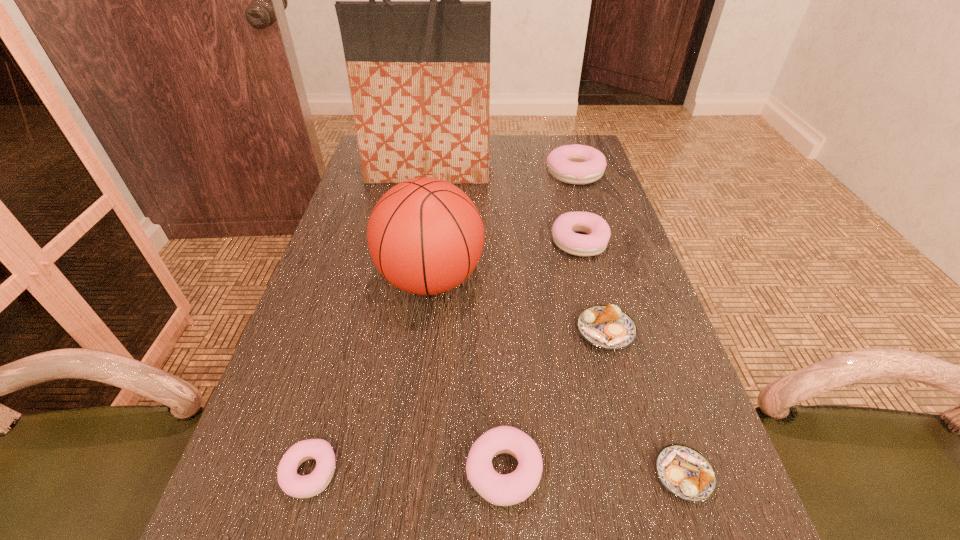
The width and height of the screenshot is (960, 540). I want to click on the leftmost pastry, so click(x=297, y=486).

The height and width of the screenshot is (540, 960). Find the location of `the leftmost pink pastry`. the leftmost pink pastry is located at coordinates 297,486.

Image resolution: width=960 pixels, height=540 pixels. I want to click on the smaller brown pastry, so click(683, 471).

You are a GUI agent. You are given a task and a screenshot of the screen. Output one action in this format:
    pyautogui.click(x=<x>, y=<y>)
    Task: Click on the free point located on the front-facing side of the tallest object
    
    Given the screenshot: What is the action you would take?
    pyautogui.click(x=413, y=264)

Find the location of a particular element. vacant space located 0.350m on the back of the basketball is located at coordinates (444, 174).

Locate an element on the screen. vacant region located on the front of the third tallest object is located at coordinates (596, 244).

In order to click on blank space located 0.270m on the back of the second biggest pink pastry in this screenshot , I will do `click(561, 173)`.

You are a GUI agent. You are given a task and a screenshot of the screen. Output one action in this format:
    pyautogui.click(x=<x>, y=<y>)
    Task: Click on the free space located 0.180m on the right of the second pastry from left to right
    The image size is (960, 540).
    Given the screenshot: What is the action you would take?
    point(656,471)

What are the coordinates of `vacant space situated on the back of the bigger brown pastry` in the screenshot? It's located at (592, 284).

Where is `vacant region located 0.270m on the back of the smallest pink pastry`? vacant region located 0.270m on the back of the smallest pink pastry is located at coordinates (352, 321).